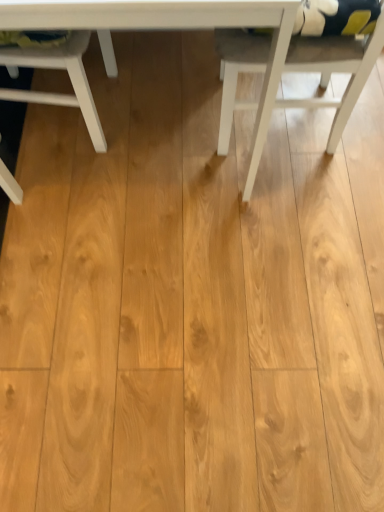
What are the coordinates of `white matte chair at right, which is the second chair in left-to-right order` in the screenshot? It's located at (334, 70).

How much space does white matte chair at upper left, positioned as the first chair in left-to-right order, occupy vertically?

51.91 centimeters.

This screenshot has width=384, height=512. What do you see at coordinates (69, 76) in the screenshot?
I see `white matte chair at upper left, arranged as the second chair when viewed from the right` at bounding box center [69, 76].

Locate an element on the screen. The height and width of the screenshot is (512, 384). white matte chair at right, which is the second chair in left-to-right order is located at coordinates (334, 70).

Considering the relative sizes of white matte chair at right, placed as the 1th chair when sorted from right to left, and white wood table at center in the image provided, is white matte chair at right, placed as the 1th chair when sorted from right to left, smaller than white wood table at center?

Yes.

Does point (236, 79) come in front of point (202, 12)?

No, it is not.

Is white matte chair at right, which is the second chair in left-to-right order, aimed at white wood table at center?

Yes, white matte chair at right, which is the second chair in left-to-right order, is aimed at white wood table at center.

From the image's perspective, does white matte chair at upper left, arranged as the second chair when viewed from the right, appear higher than white wood table at center?

No, from the image's perspective, white matte chair at upper left, arranged as the second chair when viewed from the right, is not above white wood table at center.

From a real-world perspective, is white matte chair at upper left, arranged as the second chair when viewed from the right, under white wood table at center?

Indeed, from a real-world perspective, white matte chair at upper left, arranged as the second chair when viewed from the right, is positioned beneath white wood table at center.

Find the location of a particular element. The image size is (384, 512). table on the right of white matte chair at upper left, arranged as the second chair when viewed from the right is located at coordinates (171, 28).

Is white matte chair at upper left, positioned as the first chair in left-to-right order, beside white wood table at center?

white matte chair at upper left, positioned as the first chair in left-to-right order, and white wood table at center are clearly separated.

Based on the photo, from a real-world perspective, is white wood table at center above or below white matte chair at right, placed as the 1th chair when sorted from right to left?

Clearly, from a real-world perspective, white wood table at center is above white matte chair at right, placed as the 1th chair when sorted from right to left.

This screenshot has height=512, width=384. Find the location of `table on the left of white matte chair at right, placed as the 1th chair when sorted from right to left`. table on the left of white matte chair at right, placed as the 1th chair when sorted from right to left is located at coordinates (171, 28).

From the image's perspective, is white wood table at center above or below white matte chair at right, placed as the 1th chair when sorted from right to left?

Clearly, from the image's perspective, white wood table at center is above white matte chair at right, placed as the 1th chair when sorted from right to left.

Considering the positions of objects white wood table at center and white matte chair at right, placed as the 1th chair when sorted from right to left, in the image provided, who is more to the right, white wood table at center or white matte chair at right, placed as the 1th chair when sorted from right to left,?

From the viewer's perspective, white matte chair at right, placed as the 1th chair when sorted from right to left, appears more on the right side.

Does white matte chair at right, which is the second chair in left-to-right order, have a greater width compared to white matte chair at upper left, positioned as the first chair in left-to-right order?

No, white matte chair at right, which is the second chair in left-to-right order, is not wider than white matte chair at upper left, positioned as the first chair in left-to-right order.

Is white matte chair at right, placed as the 1th chair when sorted from right to left, far from white matte chair at upper left, positioned as the first chair in left-to-right order?

white matte chair at right, placed as the 1th chair when sorted from right to left, is near white matte chair at upper left, positioned as the first chair in left-to-right order, not far away.

Would you say white matte chair at right, placed as the 1th chair when sorted from right to left, is outside white matte chair at upper left, arranged as the second chair when viewed from the right?

white matte chair at right, placed as the 1th chair when sorted from right to left, is positioned outside white matte chair at upper left, arranged as the second chair when viewed from the right.

From a real-world perspective, which is physically above, white matte chair at right, placed as the 1th chair when sorted from right to left, or white matte chair at upper left, positioned as the first chair in left-to-right order?

white matte chair at right, placed as the 1th chair when sorted from right to left, is physically above.

How many degrees apart are the facing directions of white matte chair at upper left, positioned as the first chair in left-to-right order, and white matte chair at right, which is the second chair in left-to-right order?

177 degrees separate the facing orientations of white matte chair at upper left, positioned as the first chair in left-to-right order, and white matte chair at right, which is the second chair in left-to-right order.

From the image's perspective, which one is positioned lower, white matte chair at upper left, positioned as the first chair in left-to-right order, or white matte chair at right, which is the second chair in left-to-right order?

white matte chair at upper left, positioned as the first chair in left-to-right order, appears lower in the image.

From a real-world perspective, is white matte chair at upper left, arranged as the second chair when viewed from the right, above or below white matte chair at right, which is the second chair in left-to-right order?

From a real-world perspective, white matte chair at upper left, arranged as the second chair when viewed from the right, is physically below white matte chair at right, which is the second chair in left-to-right order.

Would you say white matte chair at upper left, positioned as the first chair in left-to-right order, is outside white matte chair at right, which is the second chair in left-to-right order?

Indeed, white matte chair at upper left, positioned as the first chair in left-to-right order, is completely outside white matte chair at right, which is the second chair in left-to-right order.

Can you confirm if white wood table at center is bigger than white matte chair at upper left, positioned as the first chair in left-to-right order?

Correct, white wood table at center is larger in size than white matte chair at upper left, positioned as the first chair in left-to-right order.

Is white wood table at center facing away from white matte chair at upper left, positioned as the first chair in left-to-right order?

No, white wood table at center is not facing away from white matte chair at upper left, positioned as the first chair in left-to-right order.

Is point (178, 28) positioned before point (66, 100)?

Yes, it is.

From a real-world perspective, starting from the white wood table at center, which chair is the 1st one below it? Please provide its 2D coordinates.

[(334, 70)]

I want to click on table in front of the white matte chair at upper left, arranged as the second chair when viewed from the right, so click(171, 28).

From the image, which object appears to be nearer to white wood table at center, white matte chair at upper left, positioned as the first chair in left-to-right order, or white matte chair at right, which is the second chair in left-to-right order?

Among the two, white matte chair at right, which is the second chair in left-to-right order, is located nearer to white wood table at center.

Looking at the image, which one is located closer to white matte chair at right, which is the second chair in left-to-right order, white wood table at center or white matte chair at upper left, arranged as the second chair when viewed from the right?

Among the two, white wood table at center is located nearer to white matte chair at right, which is the second chair in left-to-right order.

Looking at the image, which one is located further to white matte chair at right, which is the second chair in left-to-right order, white matte chair at upper left, positioned as the first chair in left-to-right order, or white wood table at center?

white matte chair at upper left, positioned as the first chair in left-to-right order, lies further to white matte chair at right, which is the second chair in left-to-right order, than the other object.

Which object lies further to the anchor point white matte chair at upper left, arranged as the second chair when viewed from the right, white wood table at center or white matte chair at right, placed as the 1th chair when sorted from right to left?

white matte chair at right, placed as the 1th chair when sorted from right to left, lies further to white matte chair at upper left, arranged as the second chair when viewed from the right, than the other object.

Considering their positions, is white matte chair at right, which is the second chair in left-to-right order, positioned further to white wood table at center than white matte chair at upper left, positioned as the first chair in left-to-right order?

white matte chair at upper left, positioned as the first chair in left-to-right order, is positioned further to the anchor white wood table at center.

From the image, which object appears to be farther from white matte chair at upper left, positioned as the first chair in left-to-right order, white matte chair at right, which is the second chair in left-to-right order, or white wood table at center?

Based on the image, white matte chair at right, which is the second chair in left-to-right order, appears to be further to white matte chair at upper left, positioned as the first chair in left-to-right order.

Find the location of a particular element. The height and width of the screenshot is (512, 384). table situated between white matte chair at upper left, positioned as the first chair in left-to-right order, and white matte chair at right, which is the second chair in left-to-right order, from left to right is located at coordinates [x=171, y=28].